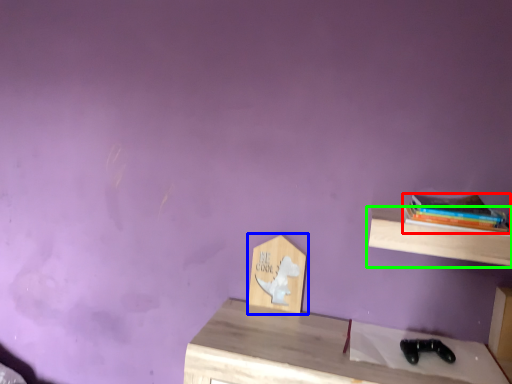
Question: Estimate the real-world distances between objects in this image. Which object is farther from book (highlighted by a red box), shelf (highlighted by a blue box) or shelf (highlighted by a green box)?

Choices:
 (A) shelf
 (B) shelf

Answer: (A)